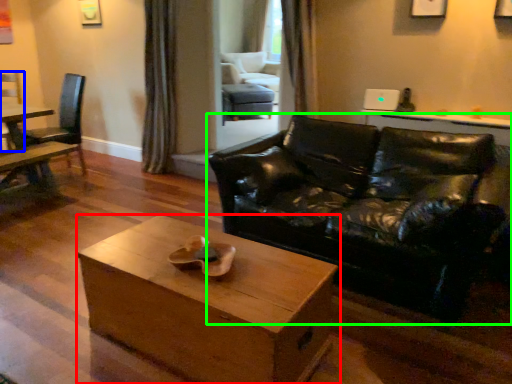
Question: Estimate the real-world distances between objects in this image. Which object is farther from coffee table (highlighted by a red box), chair (highlighted by a blue box) or studio couch (highlighted by a green box)?

Choices:
 (A) chair
 (B) studio couch

Answer: (A)